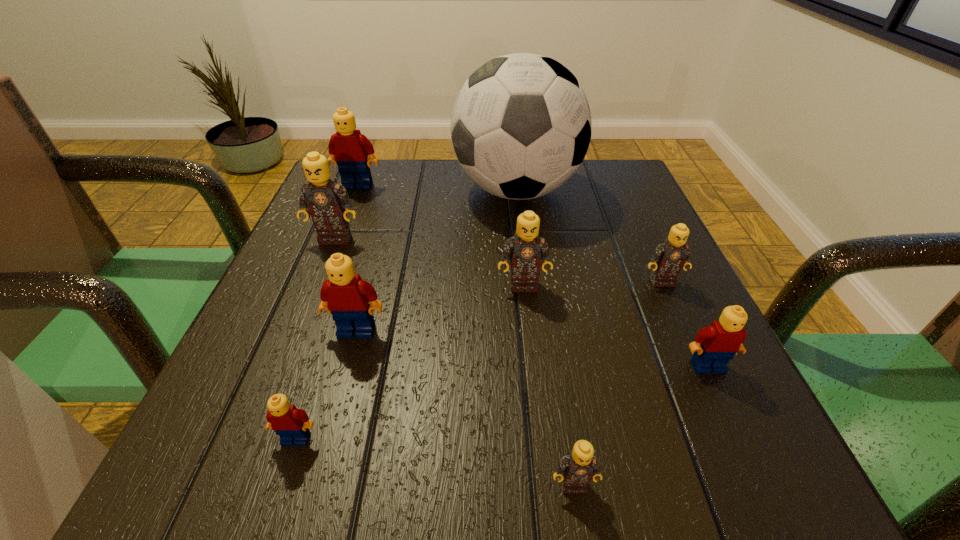
This screenshot has width=960, height=540. I want to click on the second nearest yellow Lego, so click(x=715, y=345).

Where is `the second smallest yellow Lego`? The width and height of the screenshot is (960, 540). the second smallest yellow Lego is located at coordinates (715, 345).

Find the location of `the seventh farthest Lego`. the seventh farthest Lego is located at coordinates (292, 425).

Locate an element on the screen. The width and height of the screenshot is (960, 540). the smallest yellow Lego is located at coordinates (292, 425).

At what (x,y) coordinates should I click in order to perform the action: click on the nearest Lego. Please return your answer as a coordinate pair (x, y). Looking at the image, I should click on (579, 466).

At what (x,y) coordinates should I click in order to perform the action: click on the smallest tan Lego. Please return your answer as a coordinate pair (x, y). Looking at the image, I should click on (579, 466).

Where is `vacant space located on the main logo of the black soccer ball`? Image resolution: width=960 pixels, height=540 pixels. vacant space located on the main logo of the black soccer ball is located at coordinates (357, 190).

The image size is (960, 540). What are the coordinates of `free spot located 0.110m on the main logo of the black soccer ball` in the screenshot? It's located at pos(405,190).

This screenshot has height=540, width=960. In order to click on vacant region located 0.160m on the main logo of the black soccer ball in this screenshot , I will do `click(383, 190)`.

The height and width of the screenshot is (540, 960). I want to click on vacant region located 0.140m on the front-facing side of the farthest Lego, so click(342, 227).